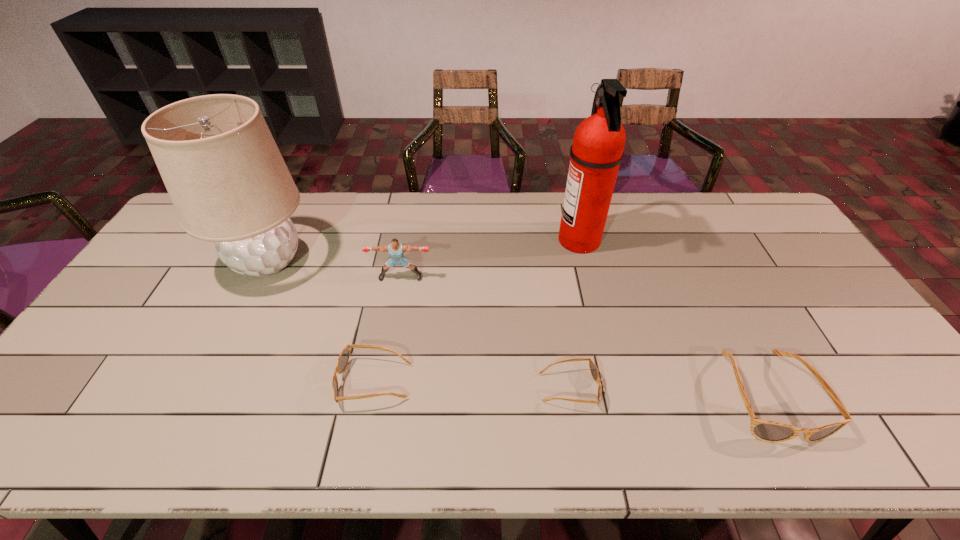
I want to click on vacant space that satisfies the following two spatial constraints: 1. on the side of the fire extinguisher near the handle; 2. on the front-facing side of the fourth shortest object, so click(588, 277).